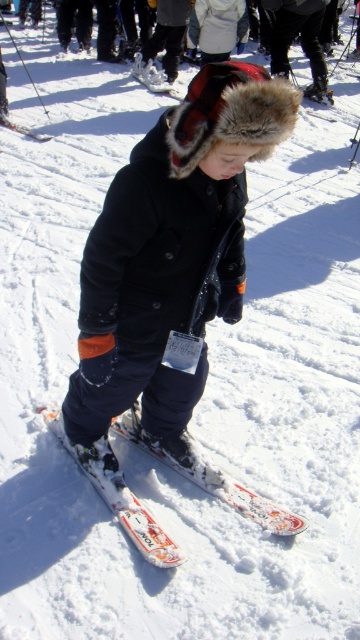
Consider the image. You are a photographer taking a picture of the child holding the tag. You want to focus on the point closer to the camera between point (x=164, y=321) and point (x=20, y=125). Which point should you choose?

Point (x=164, y=321) is closer to the camera than point (x=20, y=125), so you should focus on point (x=164, y=321).

You are a parent at a ski resort and want to locate your child who is holding a small white tag. You see two skis in the snow. The white glossy skis at center and the white plastic ski at lower center. Which one is farther from the other?

The distance between the white glossy skis at center and the white plastic ski at lower center is 5.36 meters, so the white glossy skis at center are farther from the white plastic ski at lower center by 5.36 meters.

The child is wearing a dark blue fleece jacket at center and standing on white glossy skis at center. Which item is taller when viewed from the front?

The dark blue fleece jacket at center is taller than the white glossy skis at center.